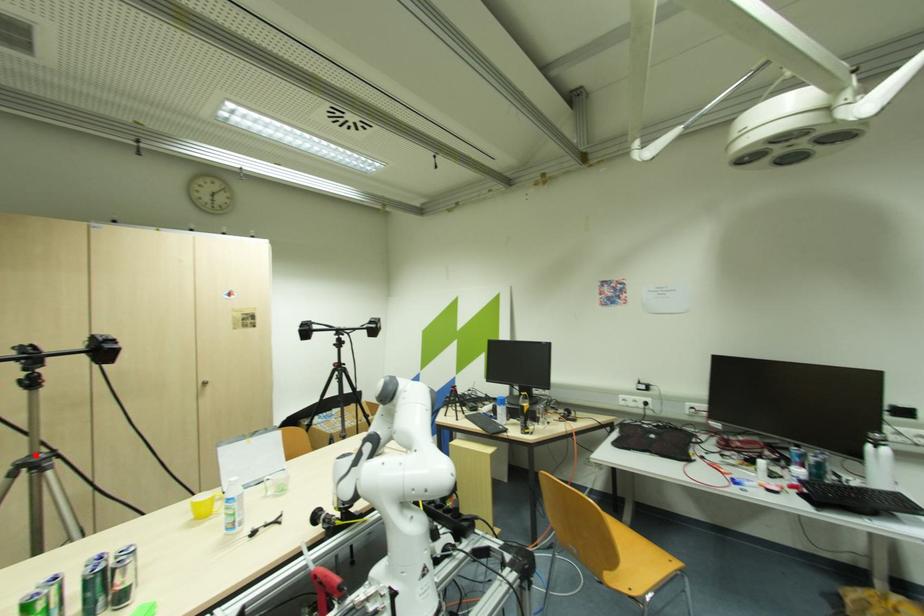
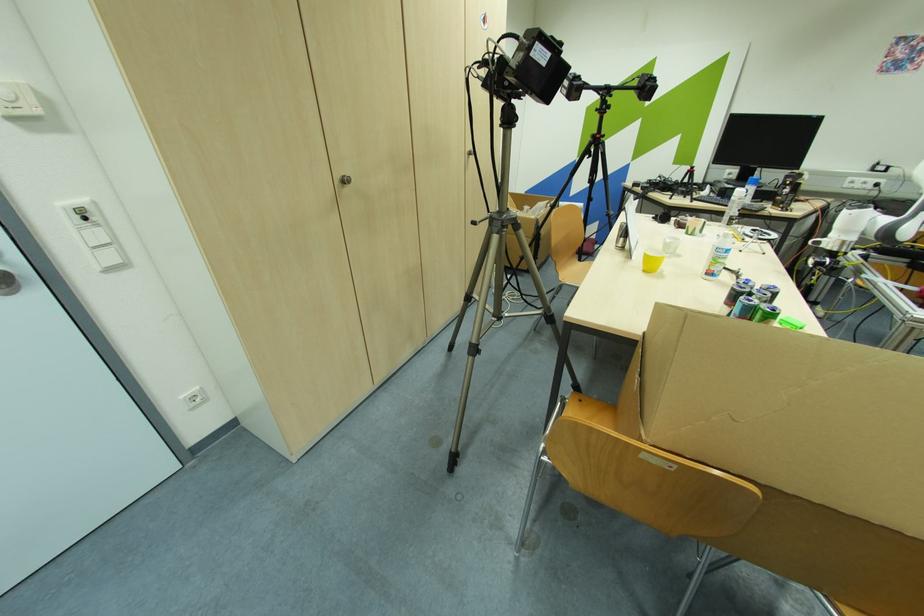
Locate, in the second image, the point that corresponds to the highlighted location in the first image.

(504, 214)